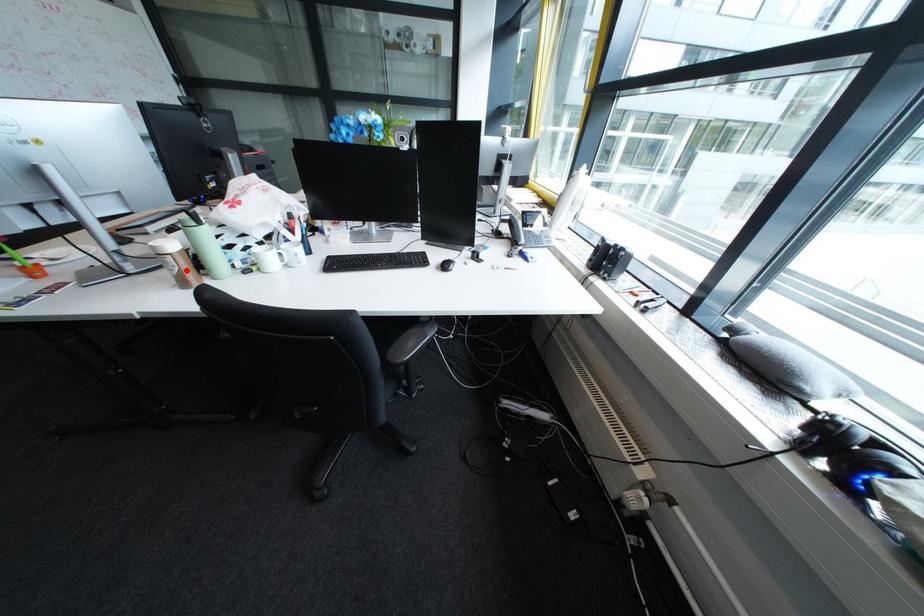
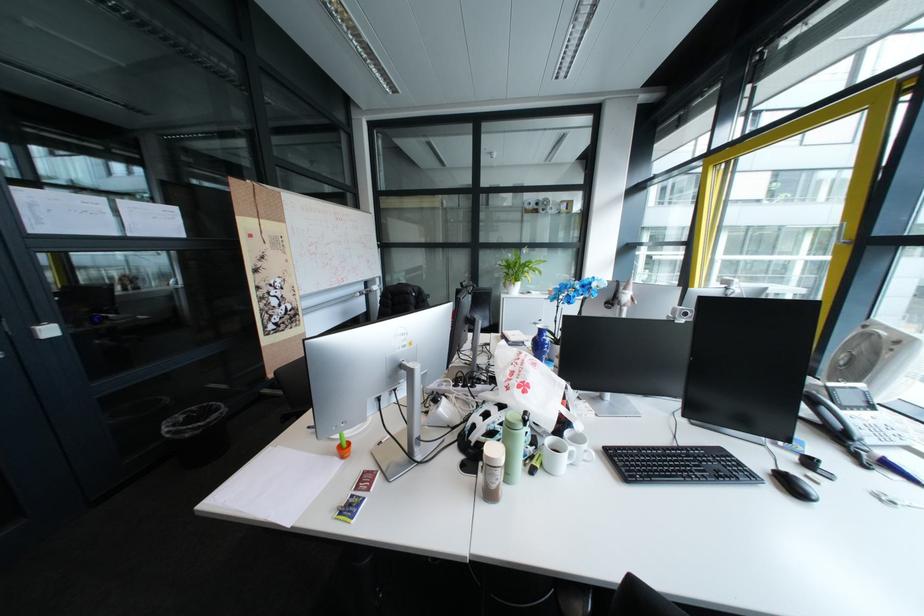
Question: I am providing you with two images of the same scene from different viewpoints. In image1, a red point is highlighted. Considering the same 3D point in image2, which of the following is correct?

Choices:
 (A) It is closer
 (B) It is farther

Answer: (B)